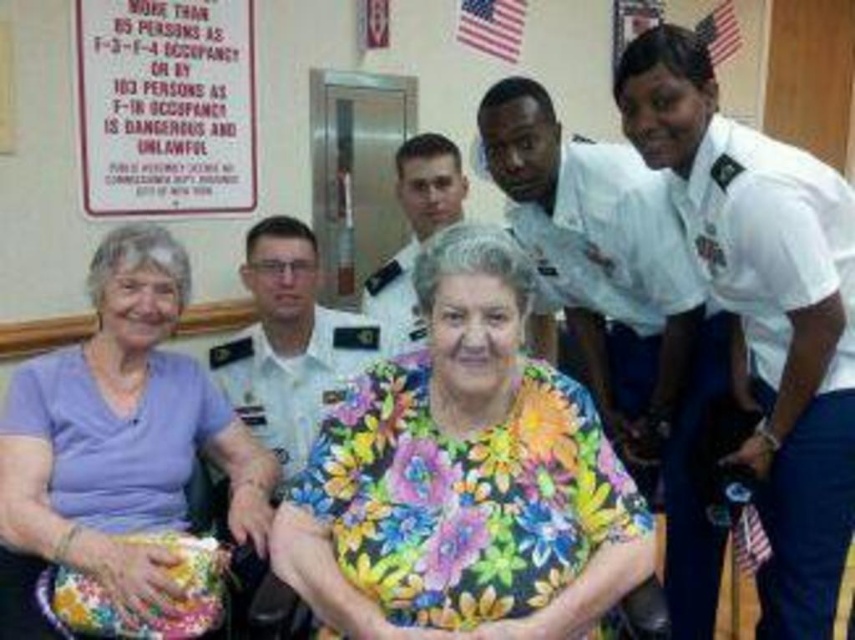
You are standing at the entrance of the room and see two points marked on the wall. The first point is at coordinate point(152, 257) and the second is at point(605, 419). Which point is closer to you?

Point(152, 257) is in front of point(605, 419), so it is closer to you.

Based on the scene description, can you determine the spatial relationship between the floral fabric shirt at center and the white uniform shirt at center?

The floral fabric shirt at center is located to the right of the white uniform shirt at center.